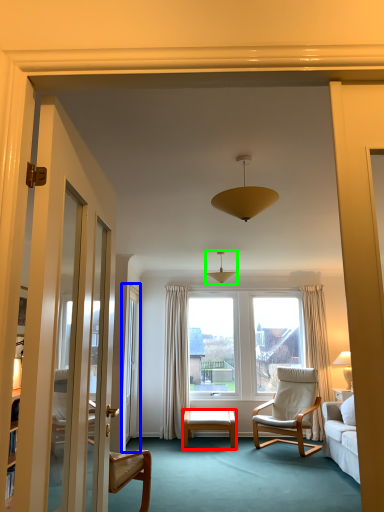
Question: Based on their relative distances, which object is nearer to desk (highlighted by a red box)? Choose from screen door (highlighted by a blue box) and light fixture (highlighted by a green box).

Choices:
 (A) screen door
 (B) light fixture

Answer: (A)